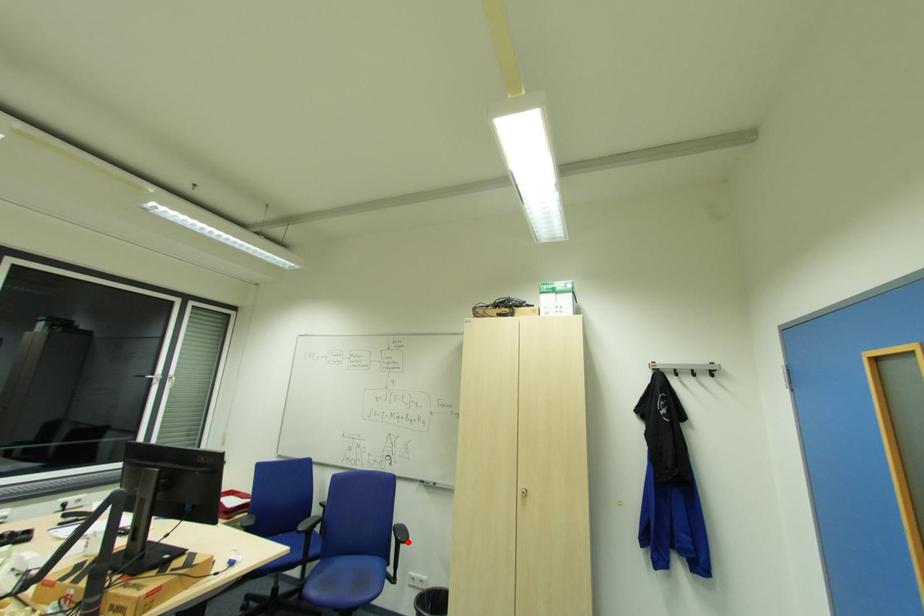
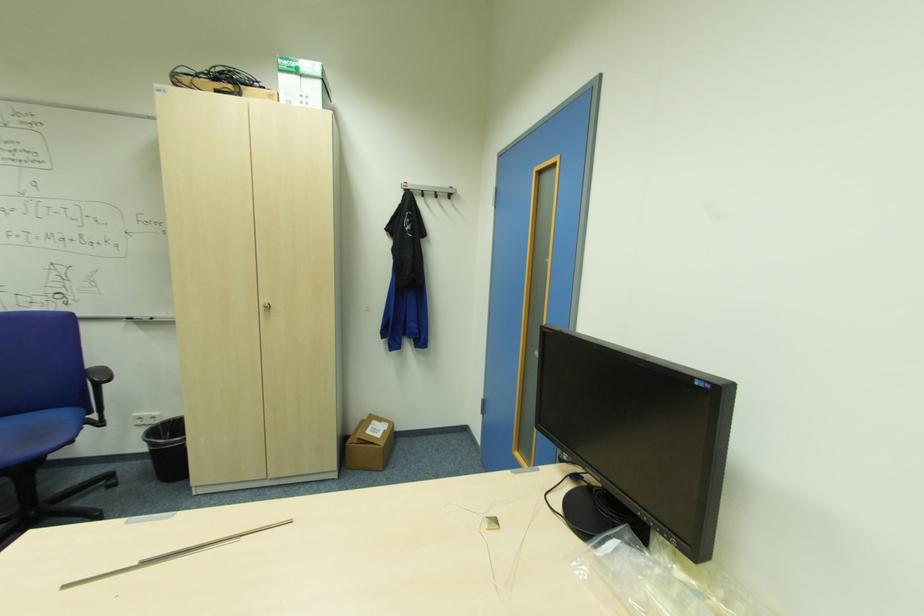
Find the pixel in the second image that matches the highlighted location in the first image.

(110, 381)